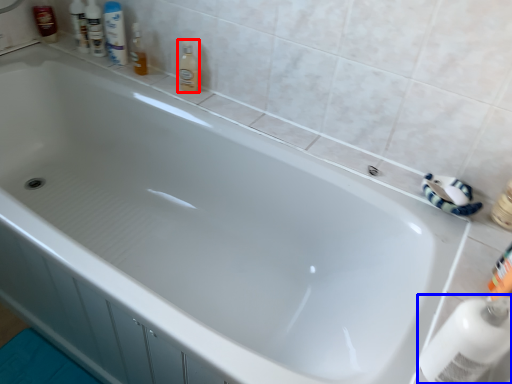
Question: Which object appears closest to the camera in this image, cleaning product (highlighted by a red box) or cleaning product (highlighted by a blue box)?

Choices:
 (A) cleaning product
 (B) cleaning product

Answer: (B)